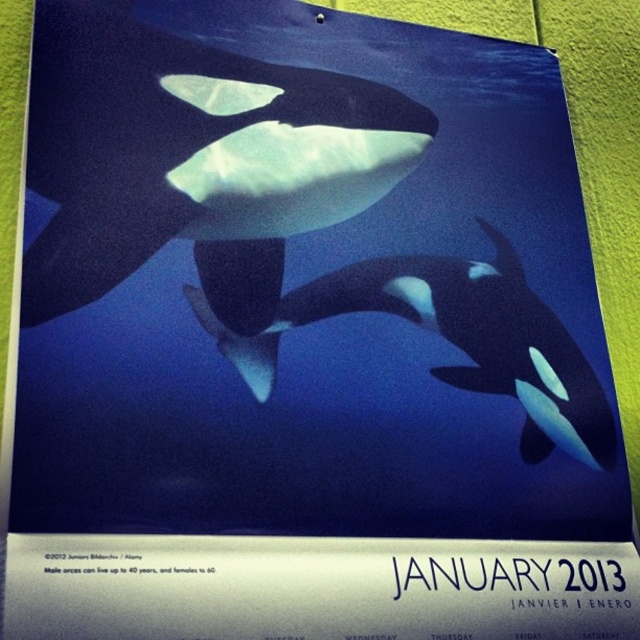
Can you confirm if matte black whale at center is positioned to the right of black matte/soft whale at center?

Incorrect, matte black whale at center is not on the right side of black matte/soft whale at center.

Which is behind, point (138, 193) or point (570, 364)?

Point (570, 364)

What are the coordinates of `matte black whale at center` in the screenshot? It's located at (195, 168).